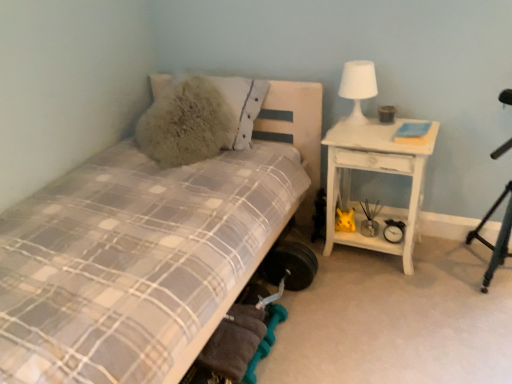
The width and height of the screenshot is (512, 384). I want to click on spots to the right of white matte table lamp at upper right, so click(399, 127).